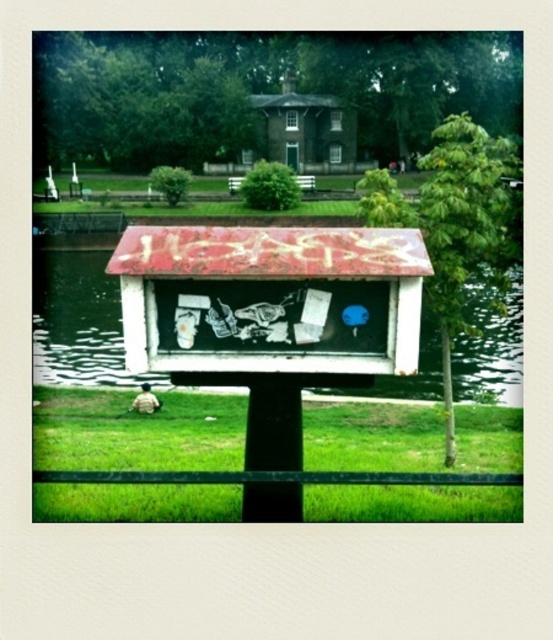
You are standing at the bus stop kiosk with the red roof and want to look at two points in the park. The first point is at coordinates point [131,512] and the second is at point [65,291]. Which point is closer to you?

Point [131,512] is closer to you than point [65,291].

You are standing at the bus stop with a red roof and looking towards the grassy area where a person is sitting. There are two points marked in the image. Which point, point (119, 433) or point (348, 166), is closer to you?

Point (119, 433) is closer to you than point (348, 166).